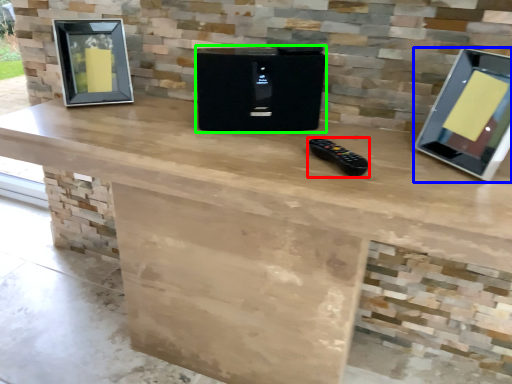
Question: Based on their relative distances, which object is nearer to game controller (highlighted by a red box)? Choose from computer monitor (highlighted by a blue box) and appliance (highlighted by a green box).

Choices:
 (A) computer monitor
 (B) appliance

Answer: (B)